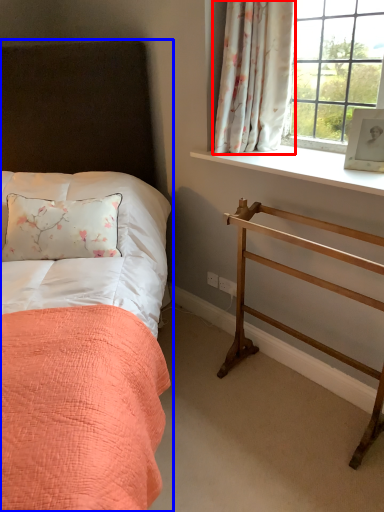
Question: Which object is closer to the camera taking this photo, curtain (highlighted by a red box) or bed (highlighted by a blue box)?

Choices:
 (A) curtain
 (B) bed

Answer: (B)